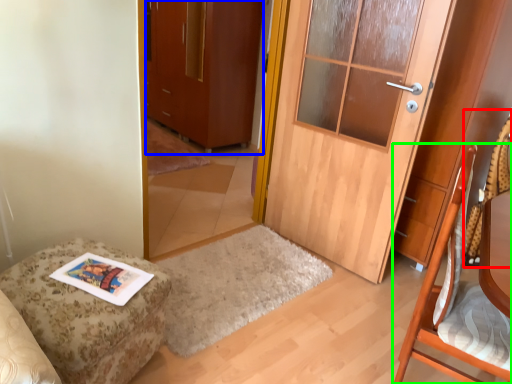
Question: Based on their relative distances, which object is farther from swivel chair (highlighted by a red box)? Choose from cabinetry (highlighted by a blue box) and chair (highlighted by a green box).

Choices:
 (A) cabinetry
 (B) chair

Answer: (A)